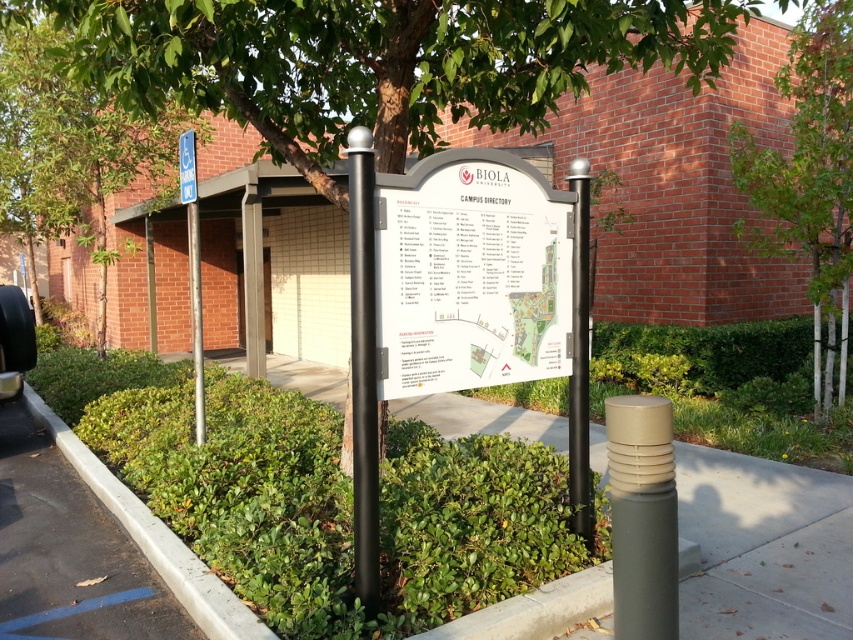
Based on the photo, which of these two, blue plastic sign at left or blue plastic parking sign at upper left, stands shorter?

blue plastic parking sign at upper left is shorter.

Describe the element at coordinates (193, 269) in the screenshot. I see `blue plastic sign at left` at that location.

Where is `blue plastic sign at left`? The height and width of the screenshot is (640, 853). blue plastic sign at left is located at coordinates (193, 269).

Can you confirm if green leafy tree at center is thinner than black metal pole at center?

No.

Does green leafy tree at center appear on the left side of black metal pole at center?

In fact, green leafy tree at center is to the right of black metal pole at center.

You are a GUI agent. You are given a task and a screenshot of the screen. Output one action in this format:
    pyautogui.click(x=<x>, y=<y>)
    Task: Click on the green leafy tree at center
    Image resolution: width=853 pixels, height=640 pixels.
    Given the screenshot: What is the action you would take?
    pyautogui.click(x=809, y=179)

Can you confirm if black metal pole at center is thinner than black matte car at lower left?

Indeed, black metal pole at center has a lesser width compared to black matte car at lower left.

This screenshot has width=853, height=640. What do you see at coordinates (579, 355) in the screenshot? I see `black metal pole at center` at bounding box center [579, 355].

Where is `black metal pole at center`? The image size is (853, 640). black metal pole at center is located at coordinates (579, 355).